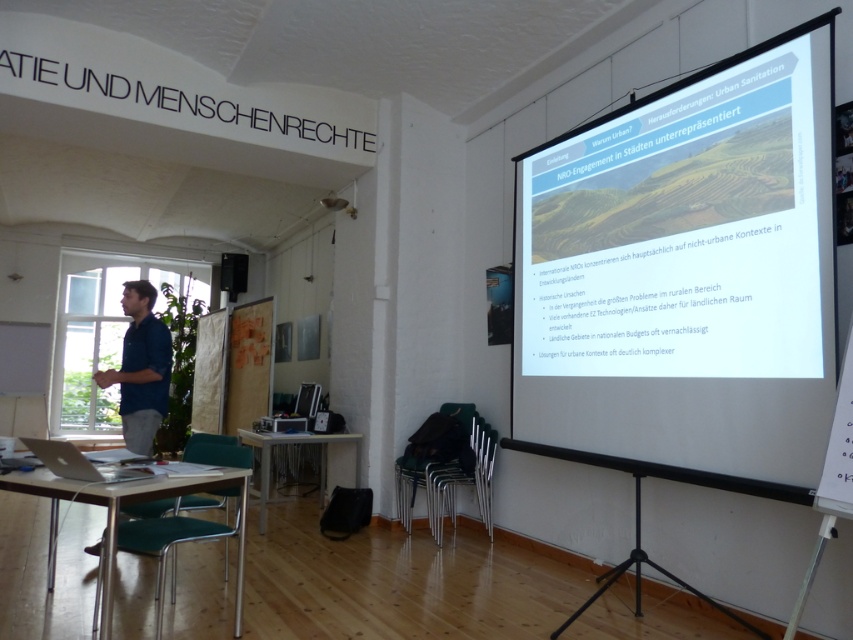
You are an attendee at a conference presentation. The presenter is speaking from the left side of the room. You want to see the slide displayed on the white matte projection screen at upper right clearly. Where should you position yourself in the room relative to the presenter?

To see the white matte projection screen at upper right clearly, you should position yourself on the right side of the room, as the screen is located at the upper right relative to the presenter.

In the scene shown: You are an attendee sitting at the back of the room. You want to ask a question to the presenter wearing the blue shirt at left. To do so, you need to walk around the wooden table at center. Can you walk around the table without passing behind it?

The blue shirt at left is in front of the wooden table at center, so the presenter is between you and the table. To reach the table, you would need to move around the presenter first, then approach the table from the front. Since the presenter is already in front of the table, you can walk around the wooden table at center without needing to go behind it by moving around the presenter and approaching from the sides or front.